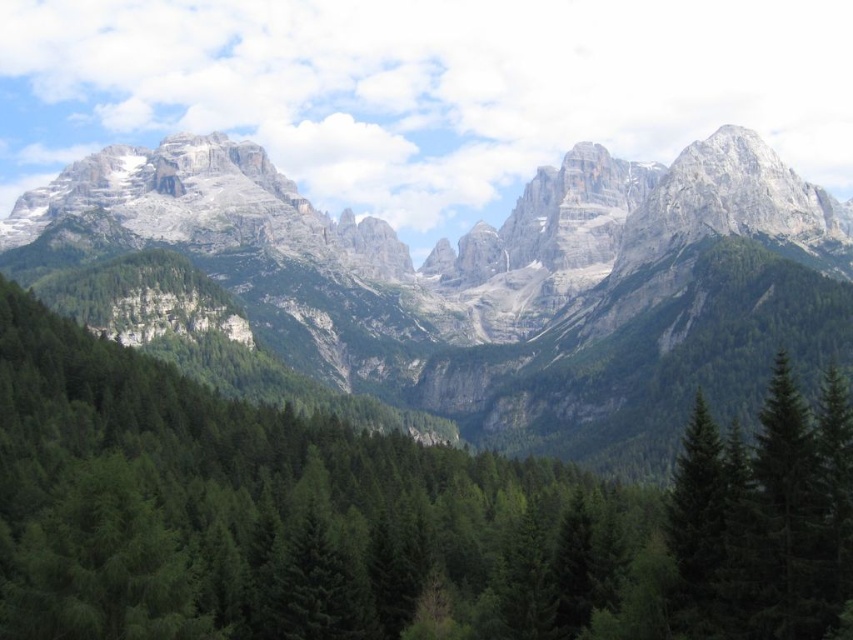
You are an environmental scientist assessing the elevation differences in the scene. Which object, the green matte tree at center or the gray rock mountain range at upper center, has a greater height?

The gray rock mountain range at upper center is taller than the green matte tree at center.

You are standing in the valley looking at the green matte tree at center and the gray rock mountain range at upper center. Which object appears closer to you?

The green matte tree at center appears closer to you because it is smaller in size compared to the gray rock mountain range at upper center, which is larger and farther away.

You are standing in the valley looking at the mountain range. There is a green matte tree at center represented by point (387, 516). Is this point located in the foreground or the background of the image?

The green matte tree at center represented by point (387, 516) is located in the foreground because the description mentions the dense forest of coniferous trees in the foreground, and the green matte tree at center is part of that forest.